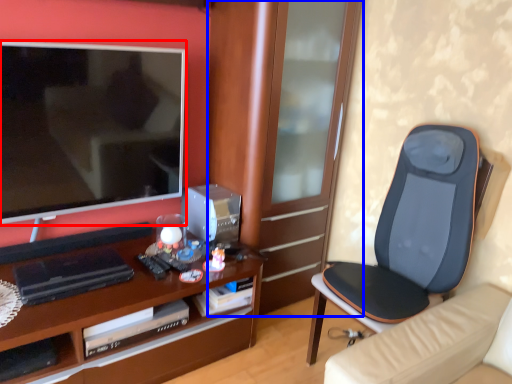
Question: Which point is closer to the camera, television (highlighted by a red box) or cabinetry (highlighted by a blue box)?

Choices:
 (A) television
 (B) cabinetry

Answer: (A)